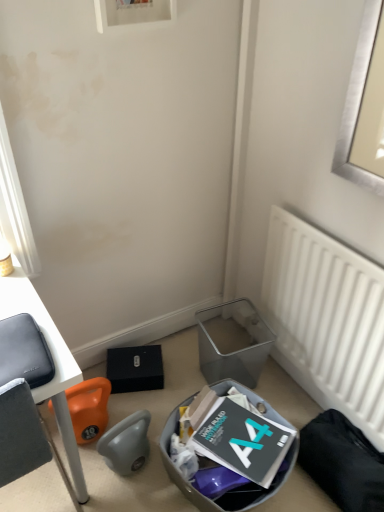
In order to face metallic gray trash bin/can at lower center, the 2th trash bin/can viewed from the front, should I rotate leftwards or rightwards?

Turn right approximately 5.564 degrees to face it.

Where is `metallic gray trash bin/can at lower center, the 1th trash bin/can viewed from the back`? metallic gray trash bin/can at lower center, the 1th trash bin/can viewed from the back is located at coordinates pos(233,342).

In order to click on metallic gray trash bin/can at lower center, the 1th trash bin/can viewed from the back in this screenshot , I will do `click(233, 342)`.

Is white matte radiator at right wider than metallic gray trash bin at lower center, which is the 2th trash bin/can in back-to-front order?

No, white matte radiator at right is not wider than metallic gray trash bin at lower center, which is the 2th trash bin/can in back-to-front order.

Can you confirm if white matte radiator at right is shorter than metallic gray trash bin at lower center, which ranks as the 1th trash bin/can in front-to-back order?

Incorrect, the height of white matte radiator at right does not fall short of that of metallic gray trash bin at lower center, which ranks as the 1th trash bin/can in front-to-back order.

Is white matte radiator at right completely or partially outside of metallic gray trash bin at lower center, which ranks as the 1th trash bin/can in front-to-back order?

Yes, white matte radiator at right is outside of metallic gray trash bin at lower center, which ranks as the 1th trash bin/can in front-to-back order.

Is white matte radiator at right not close to metallic gray trash bin at lower center, which ranks as the 1th trash bin/can in front-to-back order?

That's not correct — white matte radiator at right is a little close to metallic gray trash bin at lower center, which ranks as the 1th trash bin/can in front-to-back order.

How many degrees apart are the facing directions of metallic gray trash bin/can at lower center, the 2th trash bin/can viewed from the front, and white matte radiator at right?

There is a 80.6-degree angle between the facing directions of metallic gray trash bin/can at lower center, the 2th trash bin/can viewed from the front, and white matte radiator at right.

Is metallic gray trash bin/can at lower center, the 1th trash bin/can viewed from the back, positioned in front of white matte radiator at right?

No, the depth of metallic gray trash bin/can at lower center, the 1th trash bin/can viewed from the back, is greater than that of white matte radiator at right.

Identify the location of trash bin/can that is the 2nd object located behind the white matte radiator at right. (233, 342).

From a real-world perspective, is metallic gray trash bin at lower center, which is the 2th trash bin/can in back-to-front order, on white matte radiator at right?

Incorrect, from a real-world perspective, metallic gray trash bin at lower center, which is the 2th trash bin/can in back-to-front order, is lower than white matte radiator at right.

Can you tell me how much metallic gray trash bin at lower center, which is the 2th trash bin/can in back-to-front order, and white matte radiator at right differ in facing direction?

100 degrees.

What are the coordinates of `the 2nd trash bin/can counting from the left of the white matte radiator at right` in the screenshot? It's located at (238, 492).

Is white matte radiator at right located within metallic gray trash bin at lower center, which is the 2th trash bin/can in back-to-front order?

No, white matte radiator at right is not inside metallic gray trash bin at lower center, which is the 2th trash bin/can in back-to-front order.

In terms of size, does white matte radiator at right appear bigger or smaller than metallic gray trash bin/can at lower center, the 1th trash bin/can viewed from the back?

Clearly, white matte radiator at right is larger in size than metallic gray trash bin/can at lower center, the 1th trash bin/can viewed from the back.

Can we say white matte radiator at right lies outside metallic gray trash bin/can at lower center, the 1th trash bin/can viewed from the back?

Absolutely, white matte radiator at right is external to metallic gray trash bin/can at lower center, the 1th trash bin/can viewed from the back.

Could you measure the distance between white matte radiator at right and metallic gray trash bin/can at lower center, the 2th trash bin/can viewed from the front?

11.25 inches.

At what (x,y) coordinates should I click in order to perform the action: click on radiator located on the right of metallic gray trash bin/can at lower center, the 1th trash bin/can viewed from the back. Please return your answer as a coordinate pair (x, y). Looking at the image, I should click on (327, 319).

Is metallic gray trash bin at lower center, which is the 2th trash bin/can in back-to-front order, wider or thinner than matte black laptop at left?

Clearly, metallic gray trash bin at lower center, which is the 2th trash bin/can in back-to-front order, has less width compared to matte black laptop at left.

From the image's perspective, would you say metallic gray trash bin at lower center, which ranks as the 1th trash bin/can in front-to-back order, is positioned over matte black laptop at left?

No, from the image's perspective, metallic gray trash bin at lower center, which ranks as the 1th trash bin/can in front-to-back order, is not above matte black laptop at left.

Image resolution: width=384 pixels, height=512 pixels. What are the coordinates of `desk that appears on the left of metallic gray trash bin at lower center, which ranks as the 1th trash bin/can in front-to-back order` in the screenshot? It's located at (54, 361).

From the image's perspective, which one is positioned higher, matte black laptop at left or metallic gray trash bin/can at lower center, the 1th trash bin/can viewed from the back?

metallic gray trash bin/can at lower center, the 1th trash bin/can viewed from the back.

Is matte black laptop at left completely or partially outside of metallic gray trash bin/can at lower center, the 1th trash bin/can viewed from the back?

Indeed, matte black laptop at left is completely outside metallic gray trash bin/can at lower center, the 1th trash bin/can viewed from the back.

Measure the distance between matte black laptop at left and metallic gray trash bin/can at lower center, the 2th trash bin/can viewed from the front.

A distance of 30.96 inches exists between matte black laptop at left and metallic gray trash bin/can at lower center, the 2th trash bin/can viewed from the front.

Is point (213, 364) closer or farther from the camera than point (293, 466)?

Clearly, point (213, 364) is more distant from the camera than point (293, 466).

Is metallic gray trash bin/can at lower center, the 2th trash bin/can viewed from the front, inside or outside of metallic gray trash bin at lower center, which is the 2th trash bin/can in back-to-front order?

metallic gray trash bin/can at lower center, the 2th trash bin/can viewed from the front, is outside metallic gray trash bin at lower center, which is the 2th trash bin/can in back-to-front order.

Which of these two, metallic gray trash bin/can at lower center, the 1th trash bin/can viewed from the back, or metallic gray trash bin at lower center, which ranks as the 1th trash bin/can in front-to-back order, is smaller?

metallic gray trash bin/can at lower center, the 1th trash bin/can viewed from the back, is smaller.

Between metallic gray trash bin/can at lower center, the 2th trash bin/can viewed from the front, and metallic gray trash bin at lower center, which is the 2th trash bin/can in back-to-front order, which one appears on the left side from the viewer's perspective?

metallic gray trash bin at lower center, which is the 2th trash bin/can in back-to-front order.

Starting from the white matte radiator at right, which trash bin/can is the 1st one behind? Please provide its 2D coordinates.

[(238, 492)]

Identify the location of radiator in front of the metallic gray trash bin/can at lower center, the 2th trash bin/can viewed from the front. (327, 319).

From the image, which object appears to be farther from metallic gray trash bin at lower center, which is the 2th trash bin/can in back-to-front order, metallic gray trash bin/can at lower center, the 1th trash bin/can viewed from the back, or matte black laptop at left?

The object further to metallic gray trash bin at lower center, which is the 2th trash bin/can in back-to-front order, is matte black laptop at left.

Looking at the image, which one is located further to white matte radiator at right, metallic gray trash bin/can at lower center, the 2th trash bin/can viewed from the front, or metallic gray trash bin at lower center, which ranks as the 1th trash bin/can in front-to-back order?

metallic gray trash bin at lower center, which ranks as the 1th trash bin/can in front-to-back order.

Which object lies further to the anchor point matte black laptop at left, metallic gray trash bin at lower center, which ranks as the 1th trash bin/can in front-to-back order, or white matte radiator at right?

white matte radiator at right is further to matte black laptop at left.

Considering their positions, is white matte radiator at right positioned closer to metallic gray trash bin/can at lower center, the 2th trash bin/can viewed from the front, than matte black laptop at left?

white matte radiator at right is positioned closer to the anchor metallic gray trash bin/can at lower center, the 2th trash bin/can viewed from the front.

When comparing their distances from matte black laptop at left, does metallic gray trash bin/can at lower center, the 1th trash bin/can viewed from the back, or metallic gray trash bin at lower center, which is the 2th trash bin/can in back-to-front order, seem closer?

Among the two, metallic gray trash bin at lower center, which is the 2th trash bin/can in back-to-front order, is located nearer to matte black laptop at left.

Estimate the real-world distances between objects in this image. Which object is closer to white matte radiator at right, metallic gray trash bin at lower center, which is the 2th trash bin/can in back-to-front order, or matte black laptop at left?

The object closer to white matte radiator at right is metallic gray trash bin at lower center, which is the 2th trash bin/can in back-to-front order.

Based on their spatial positions, is metallic gray trash bin at lower center, which ranks as the 1th trash bin/can in front-to-back order, or metallic gray trash bin/can at lower center, the 1th trash bin/can viewed from the back, further from white matte radiator at right?

The object further to white matte radiator at right is metallic gray trash bin at lower center, which ranks as the 1th trash bin/can in front-to-back order.

Considering their positions, is matte black laptop at left positioned further to metallic gray trash bin/can at lower center, the 1th trash bin/can viewed from the back, than white matte radiator at right?

matte black laptop at left is positioned further to the anchor metallic gray trash bin/can at lower center, the 1th trash bin/can viewed from the back.

The width and height of the screenshot is (384, 512). I want to click on trash bin/can positioned between matte black laptop at left and metallic gray trash bin/can at lower center, the 1th trash bin/can viewed from the back, from near to far, so click(238, 492).

Where is `trash bin/can located between white matte radiator at right and metallic gray trash bin/can at lower center, the 2th trash bin/can viewed from the front, in the depth direction`? trash bin/can located between white matte radiator at right and metallic gray trash bin/can at lower center, the 2th trash bin/can viewed from the front, in the depth direction is located at coordinates (238, 492).